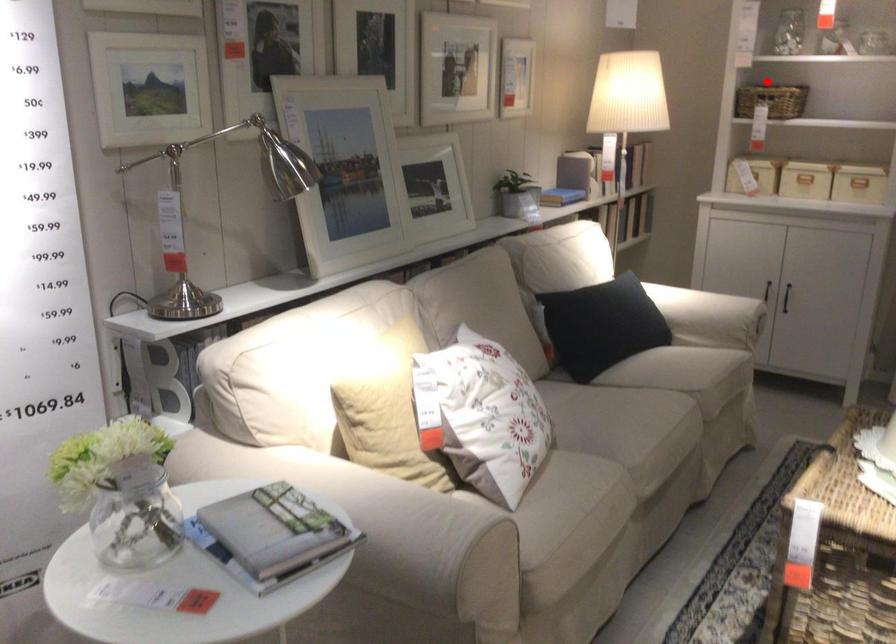
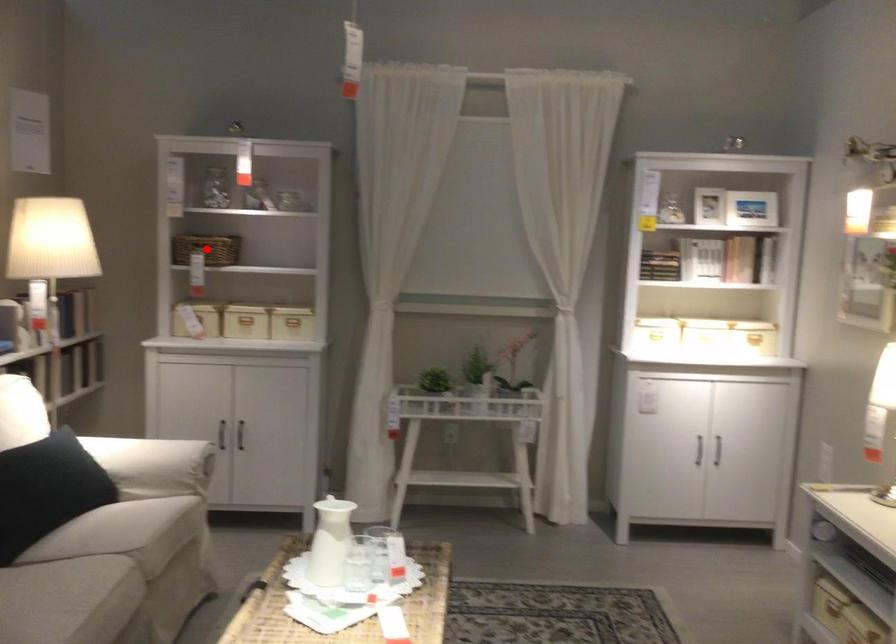
I am providing you with two images of the same scene from different viewpoints. A red point is marked on the first image and another point is marked on the second image. Is the marked point in image1 the same physical position as the marked point in image2?

Yes